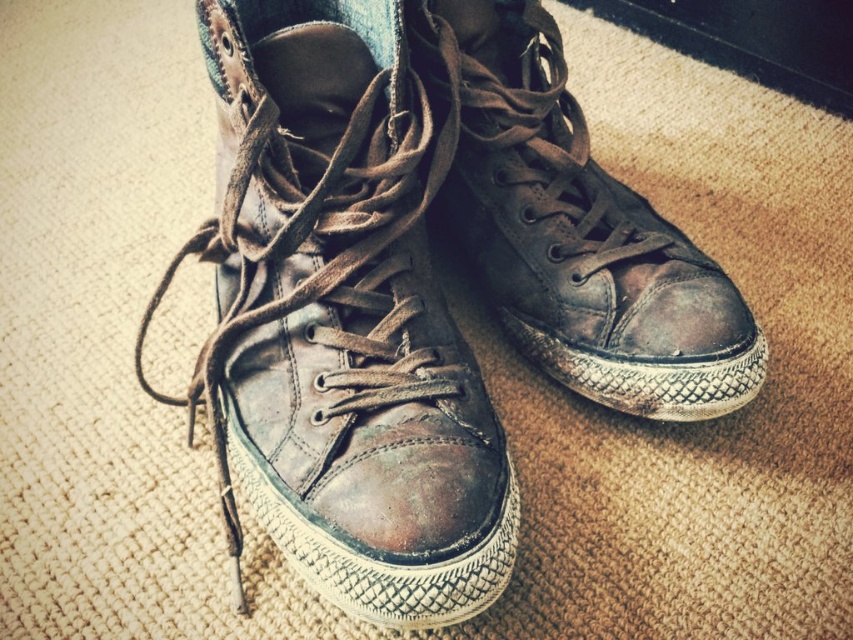
You are placing a new rug in your living room and want to ensure it fits under the worn leather boot at center. The rug you chose has dimensions of 0.4 meters by 0.3 meters. Can the rug be placed entirely under the boot without overlapping its edges?

The worn leather boot at center is located at point (341, 321). Since the rug is 0.4 meters by 0.3 meters, it can be positioned under the boot as long as the boot is within the rug dimensions. However, the exact placement depends on the boot size and rug positioning. Without knowing the boot size, it is uncertain if it fits entirely under the rug.